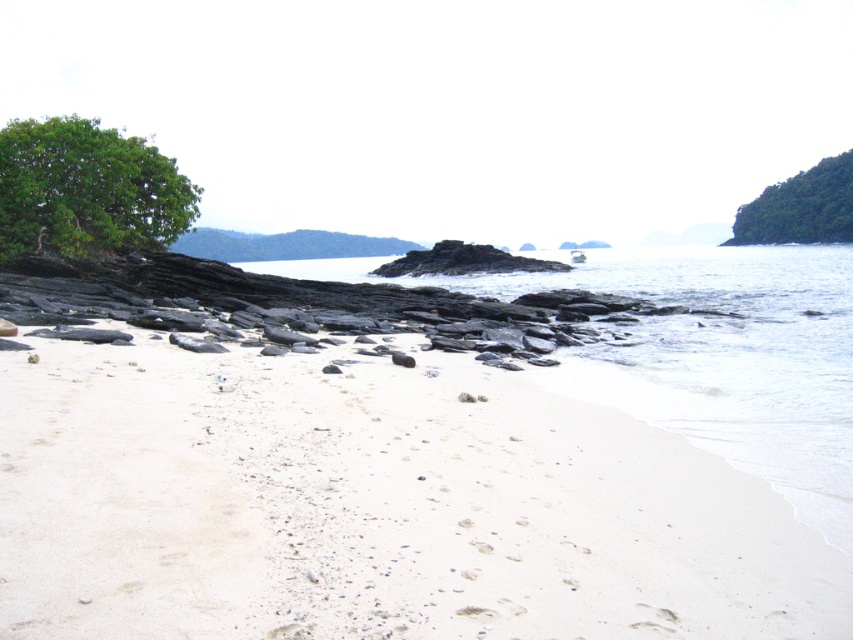
You are standing at the shoreline on the beach and want to reach both the point at coordinates point (842,506) and the point at coordinates point (850,230). Which point will require you to walk further away from the shoreline?

The point at coordinates point (850,230) will require walking further away from the shoreline because it is farther from the camera compared to point (842,506).

You are standing on the white sandy beach at lower left and want to reach the clear water at center. Which direction should you move to get there?

You should move forward because the white sandy beach at lower left is in front of clear water at center, so moving forward from the beach will lead you directly to the water.

You are standing at the point marked as point (706,355) on the beach. What type of terrain are you currently on?

You are standing on clear water at center, which is located at point (706,355).